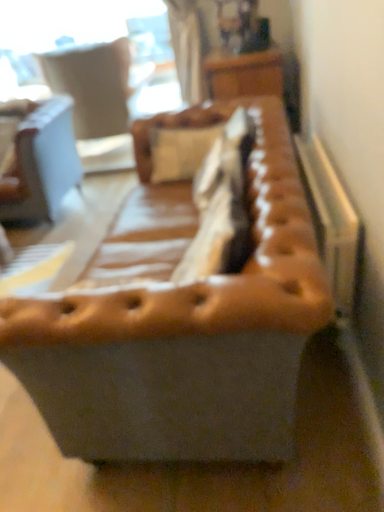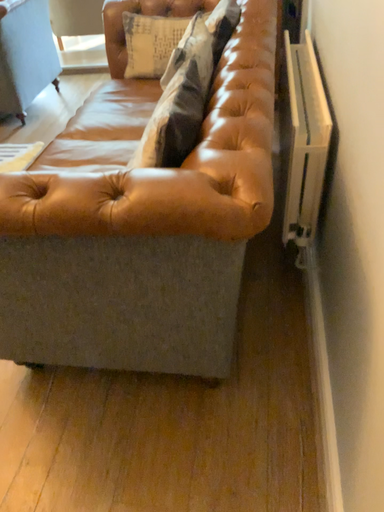
Question: Which way did the camera rotate in the video?

Choices:
 (A) rotated upward
 (B) rotated downward

Answer: (B)